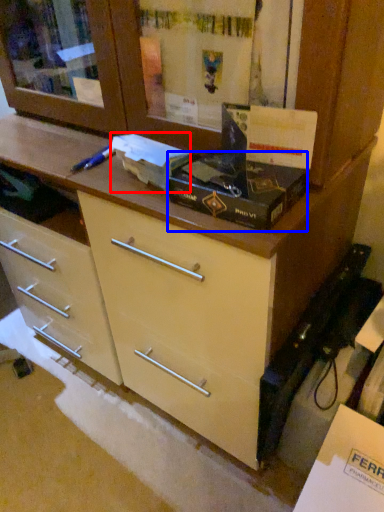
Question: Which point is closer to the camera, box (highlighted by a red box) or box (highlighted by a blue box)?

Choices:
 (A) box
 (B) box

Answer: (B)